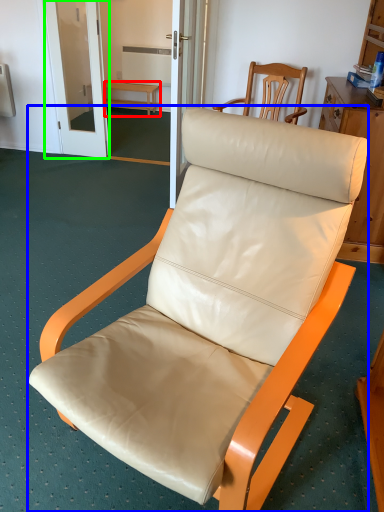
Question: Which is nearer to the furniture (highlighted by a red box)? chair (highlighted by a blue box) or screen door (highlighted by a green box).

Choices:
 (A) chair
 (B) screen door

Answer: (B)